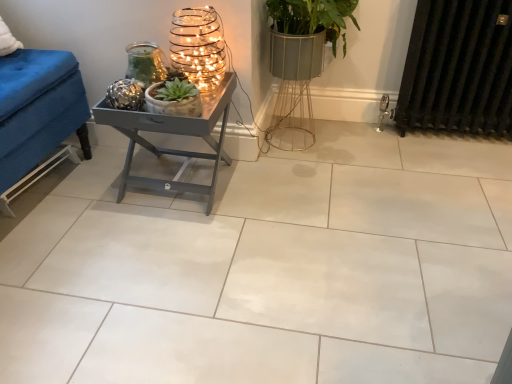
The width and height of the screenshot is (512, 384). In order to click on free space in front of metallic gray table at center in this screenshot , I will do `click(163, 238)`.